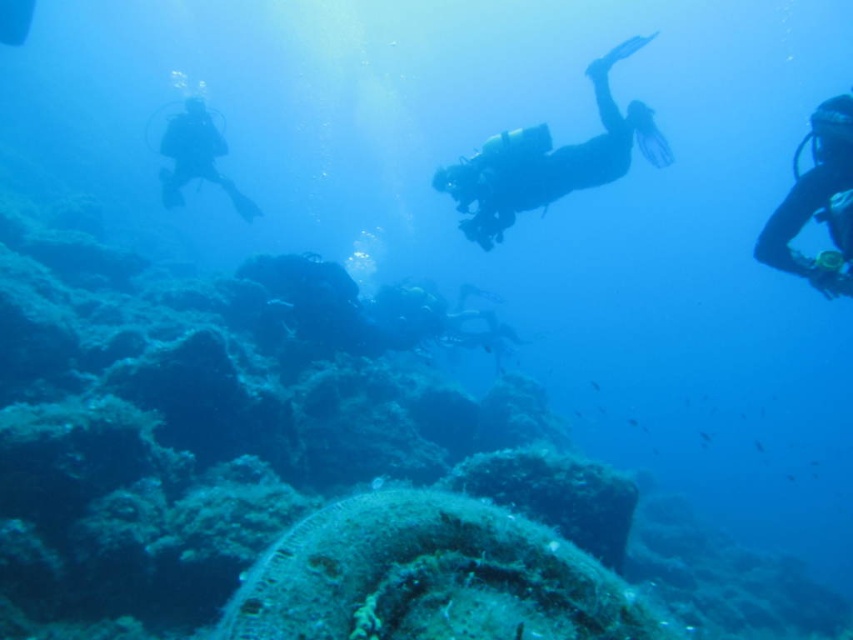
Question: Does black matte scuba diver at right appear on the right side of silhouette diving gear at left?

Choices:
 (A) no
 (B) yes

Answer: (B)

Question: Does black matte scuba diver at right have a greater width compared to silhouette diving gear at left?

Choices:
 (A) no
 (B) yes

Answer: (A)

Question: Can you confirm if black matte scuba diver at center is positioned above silhouette diving gear at left?

Choices:
 (A) no
 (B) yes

Answer: (A)

Question: Which of the following is the farthest from the observer?

Choices:
 (A) black matte scuba diver at center
 (B) black matte scuba diver at right

Answer: (A)

Question: Among these points, which one is farthest from the camera?

Choices:
 (A) (595, 81)
 (B) (206, 179)

Answer: (B)

Question: Which point is closer to the camera?

Choices:
 (A) (606, 125)
 (B) (845, 168)
 (C) (171, 200)

Answer: (B)